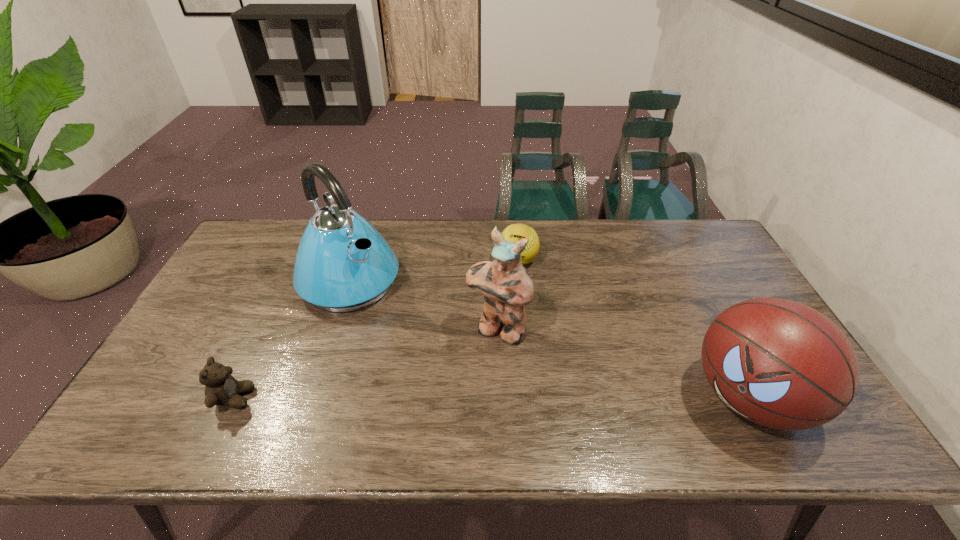
Locate an element on the screen. The height and width of the screenshot is (540, 960). free space between the figurine and the basketball is located at coordinates (623, 363).

The height and width of the screenshot is (540, 960). What are the coordinates of `free space between the basketball and the fourth shortest object` in the screenshot? It's located at (623, 363).

You are a GUI agent. You are given a task and a screenshot of the screen. Output one action in this format:
    pyautogui.click(x=<x>, y=<y>)
    Task: Click on the free space between the basketball and the tallest object
    Image resolution: width=960 pixels, height=540 pixels.
    Given the screenshot: What is the action you would take?
    pyautogui.click(x=549, y=340)

Locate an element on the screen. Image resolution: width=960 pixels, height=540 pixels. free space between the teddy bear and the kettle is located at coordinates (292, 340).

At what (x,y) coordinates should I click in order to perform the action: click on empty space that is in between the rightmost object and the second tallest object. Please return your answer as a coordinate pair (x, y). Looking at the image, I should click on pyautogui.click(x=623, y=363).

Where is `empty space that is in between the softball and the kettle`? Image resolution: width=960 pixels, height=540 pixels. empty space that is in between the softball and the kettle is located at coordinates (434, 271).

Find the location of a particular element. This screenshot has width=960, height=540. object that can be found as the fourth closest to the teddy bear is located at coordinates (781, 364).

Locate which object is the closest to the second tallest object. Please provide its 2D coordinates. Your answer should be formatted as a tuple, i.e. [(x, y)], where the tuple contains the x and y coordinates of a point satisfying the conditions above.

[(515, 232)]

Where is `free space in the image that satisfies the following two spatial constraints: 1. on the front side of the softball; 2. on the right side of the basketball`? free space in the image that satisfies the following two spatial constraints: 1. on the front side of the softball; 2. on the right side of the basketball is located at coordinates (531, 398).